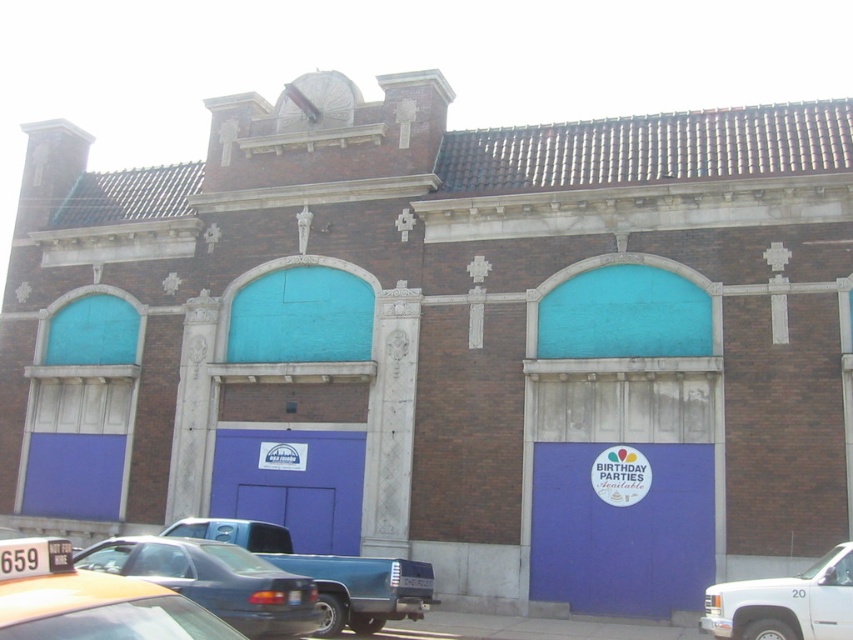
Who is shorter, blue matte garage door at center or yellow rubber taxi cab at lower left?

With less height is blue matte garage door at center.

Is point (329, 486) farther from viewer compared to point (18, 570)?

That is True.

Where is `blue matte garage door at center`? blue matte garage door at center is located at coordinates (292, 483).

Does blue matte garage door at center appear on the left side of white matte truck at lower right?

Correct, you'll find blue matte garage door at center to the left of white matte truck at lower right.

Locate an element on the screen. blue matte garage door at center is located at coordinates (292, 483).

The image size is (853, 640). What are the coordinates of `blue matte garage door at lower right` in the screenshot? It's located at (621, 525).

Is blue matte garage door at lower right bigger than white matte truck at lower right?

No, blue matte garage door at lower right is not bigger than white matte truck at lower right.

Is point (601, 595) behind point (723, 605)?

Yes, it is.

Find the location of `blue matte garage door at lower right`. blue matte garage door at lower right is located at coordinates (621, 525).